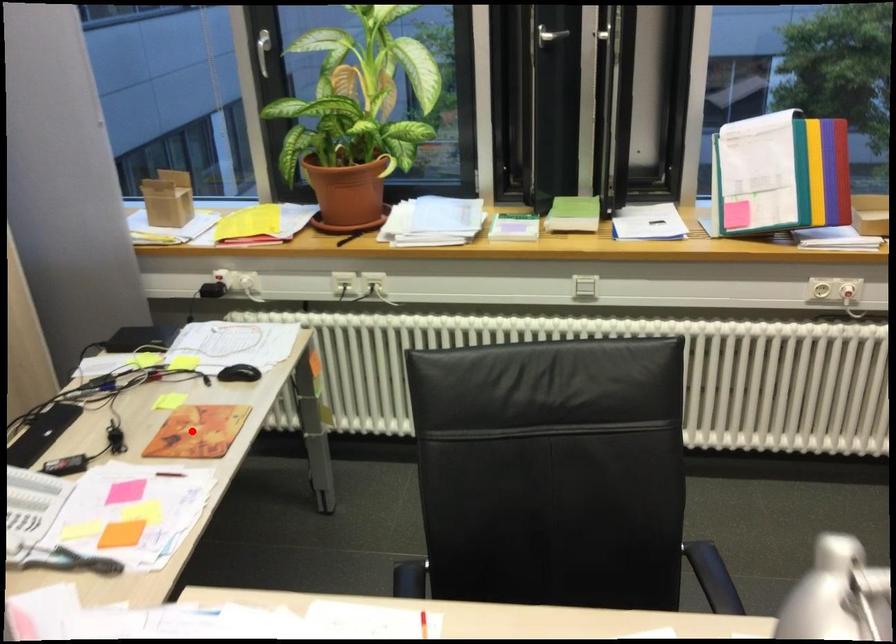
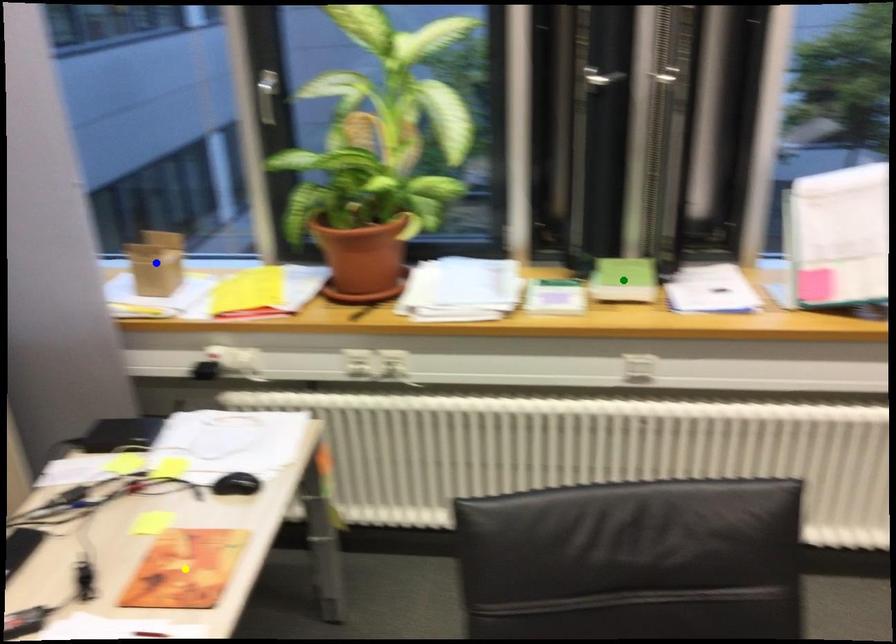
Question: I am providing you with two images of the same scene from different viewpoints. A red point is marked on the first image. You are given multiple points on the second image. Which point in image 2 represents the same 3d spot as the red point in image 1?

Choices:
 (A) yellow point
 (B) green point
 (C) blue point

Answer: (A)